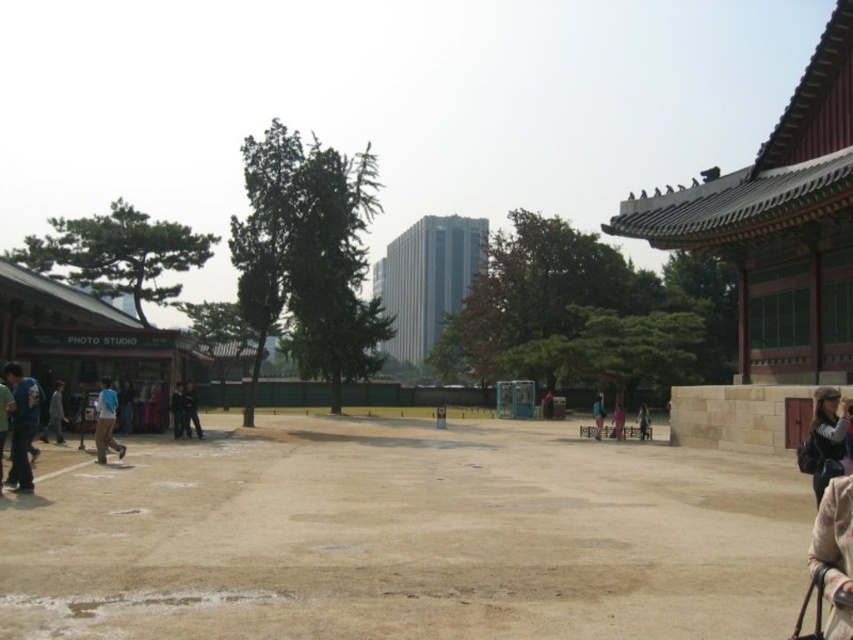
You are standing at the entrance of the courtyard and want to reach the brown sandy ground at center. According to the image, in which direction should you walk from your current position?

The brown sandy ground at center is located at point (x=407, y=538), so you should walk towards the center of the courtyard to reach it.